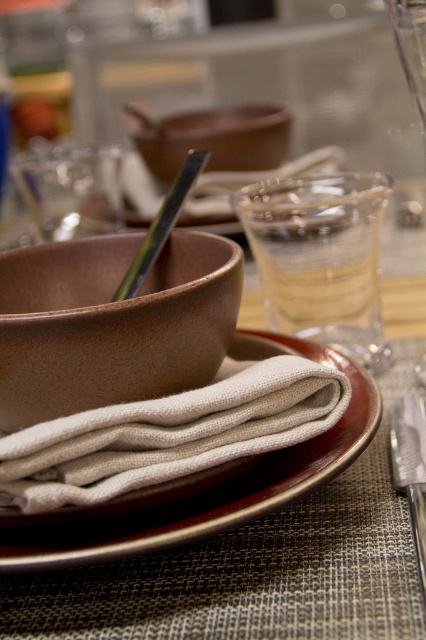
Question: Can you confirm if brown matte plate at center is positioned to the left of matte brown bowl at center?

Choices:
 (A) no
 (B) yes

Answer: (A)

Question: Considering the relative positions of brown matte bowl at center and matte brown bowl at center in the image provided, where is brown matte bowl at center located with respect to matte brown bowl at center?

Choices:
 (A) above
 (B) below

Answer: (B)

Question: Which object is the farthest from the matte brown bowl at center?

Choices:
 (A) brown matte bowl at center
 (B) brown matte plate at center

Answer: (B)

Question: Considering the real-world distances, which object is farthest from the brown matte plate at center?

Choices:
 (A) polished silver knife at lower right
 (B) matte brown bowl at center
 (C) brown matte bowl at center

Answer: (B)

Question: Which point appears closest to the camera in this image?

Choices:
 (A) (158, 508)
 (B) (273, 150)
 (C) (77, 342)

Answer: (C)

Question: Does brown matte plate at center appear over polished silver knife at lower right?

Choices:
 (A) yes
 (B) no

Answer: (A)